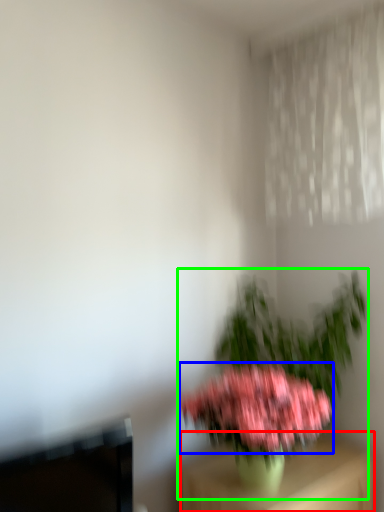
Question: Which object is positioned farthest from furniture (highlighted by a red box)? Select from flower (highlighted by a blue box) and houseplant (highlighted by a green box).

Choices:
 (A) flower
 (B) houseplant

Answer: (B)